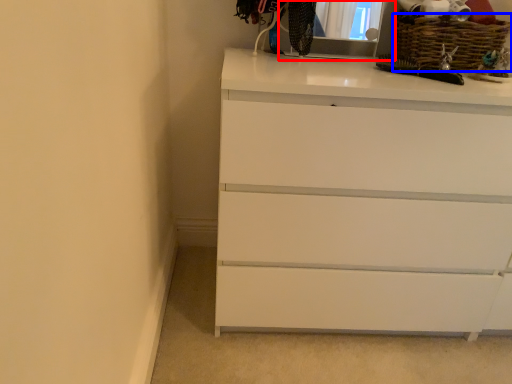
Question: Which object appears closest to the camera in this image, medicine cabinet (highlighted by a red box) or basket (highlighted by a blue box)?

Choices:
 (A) medicine cabinet
 (B) basket

Answer: (A)